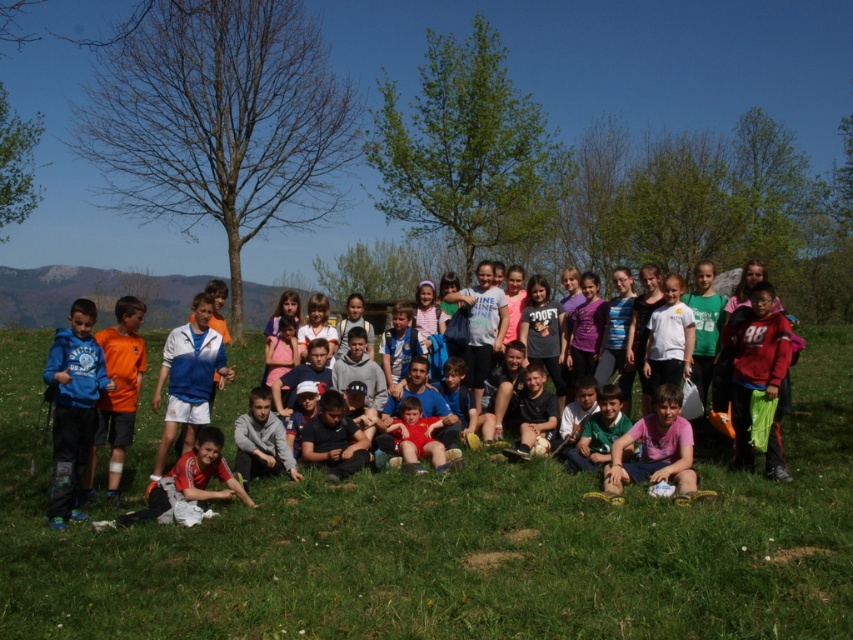
Question: Does matte blue hoodie at center appear over blue fleece jacket at lower left?

Choices:
 (A) yes
 (B) no

Answer: (B)

Question: Which point is farther to the camera?

Choices:
 (A) click(x=184, y=340)
 (B) click(x=360, y=625)

Answer: (A)

Question: Based on their relative distances, which object is nearer to the matte blue hoodie at center?

Choices:
 (A) multicolored clothing at center
 (B) white jersey at center
 (C) blue fleece jacket at lower left

Answer: (B)

Question: Can you confirm if multicolored clothing at center is smaller than white jersey at center?

Choices:
 (A) yes
 (B) no

Answer: (B)

Question: Does matte blue hoodie at center have a larger size compared to blue fleece jacket at lower left?

Choices:
 (A) yes
 (B) no

Answer: (B)

Question: Which of the following is the farthest from the observer?

Choices:
 (A) white jersey at center
 (B) blue fleece jacket at lower left
 (C) multicolored clothing at center

Answer: (A)